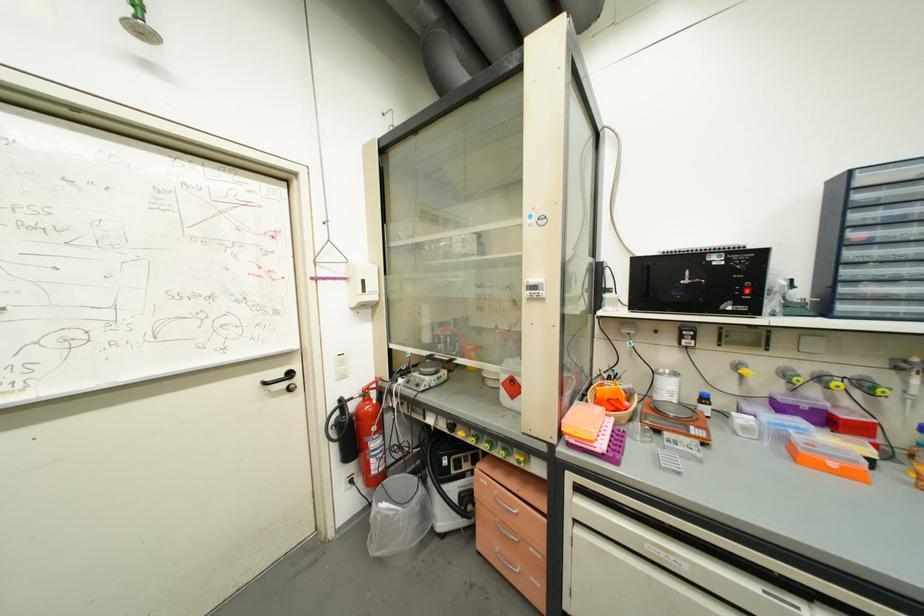
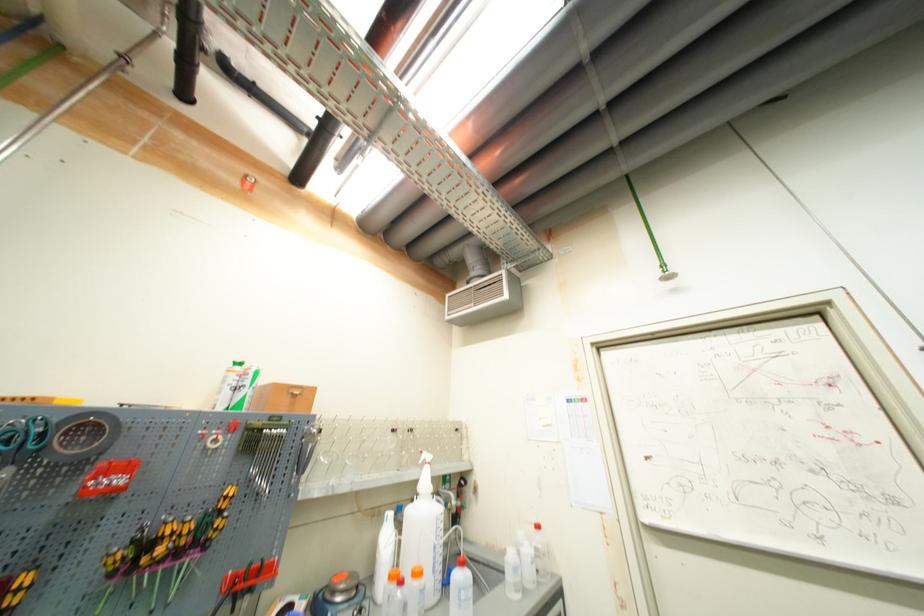
The first image is from the beginning of the video and the second image is from the end. How did the camera likely rotate when shooting the video?

The camera rotated toward left-up.